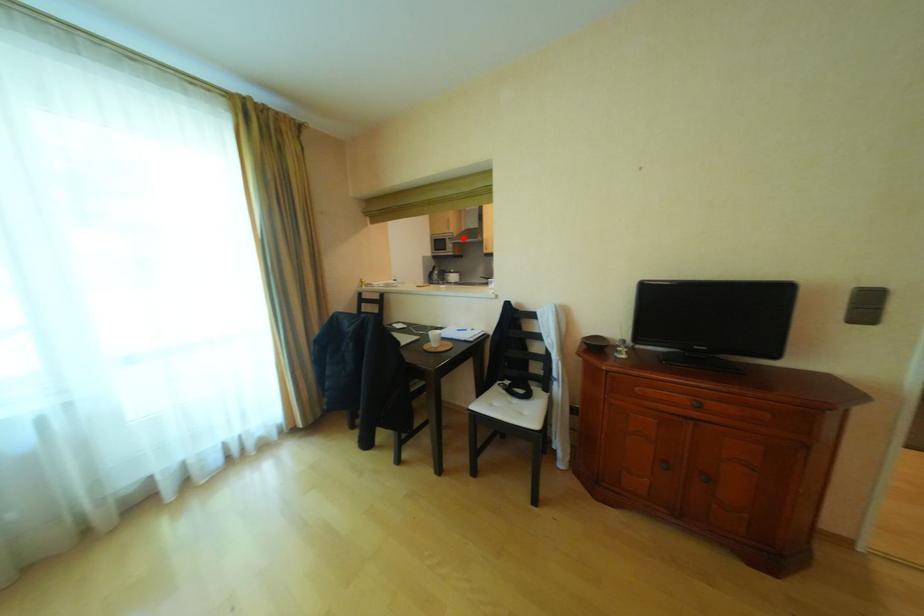
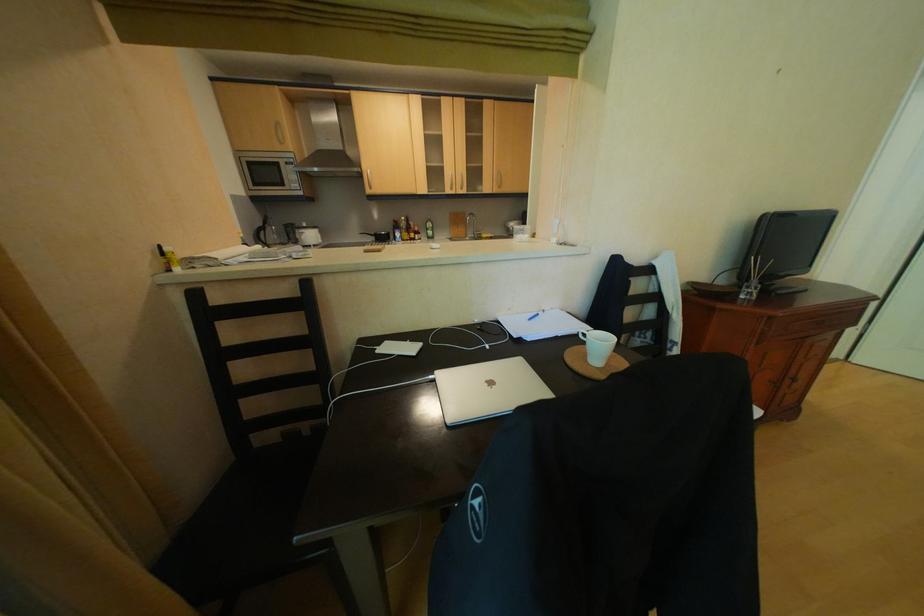
Find the pixel in the second image that matches the highlighted location in the first image.

(304, 161)